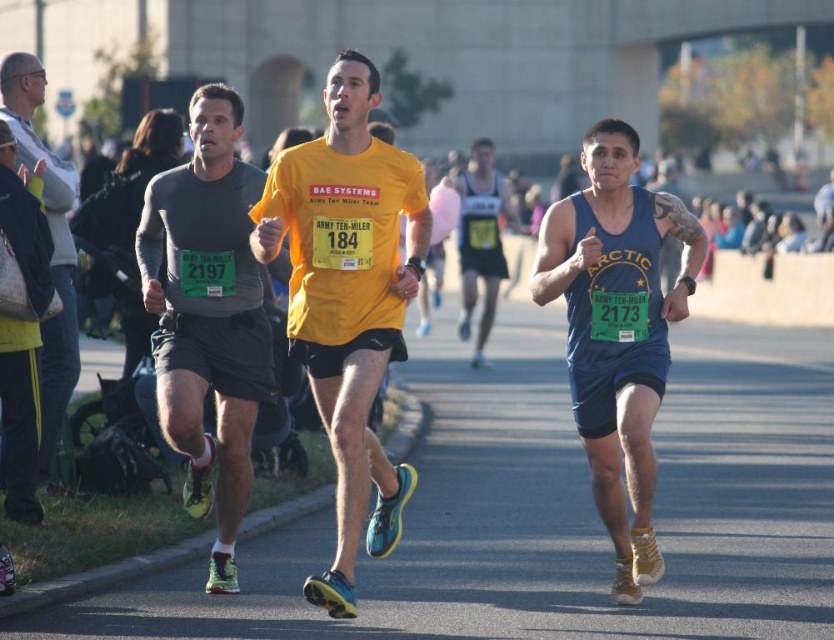
Can you confirm if matte blue tank top at center is smaller than matte gray long-sleeve shirt at left?

Yes, matte blue tank top at center is smaller than matte gray long-sleeve shirt at left.

Can you confirm if matte blue tank top at center is positioned to the right of matte gray long-sleeve shirt at left?

Yes, matte blue tank top at center is to the right of matte gray long-sleeve shirt at left.

Where is `matte blue tank top at center`? The image size is (834, 640). matte blue tank top at center is located at coordinates (616, 330).

Which of these two, yellow matte shirt at center or matte gray jacket at left, stands shorter?

With less height is matte gray jacket at left.

Is yellow matte shirt at center to the left of matte gray jacket at left from the viewer's perspective?

No, yellow matte shirt at center is not to the left of matte gray jacket at left.

I want to click on yellow matte shirt at center, so click(348, 300).

I want to click on yellow matte shirt at center, so click(x=348, y=300).

In the scene shown: Is matte gray long-sleeve shirt at left wider than matte gray jacket at left?

Correct, the width of matte gray long-sleeve shirt at left exceeds that of matte gray jacket at left.

Does matte gray long-sleeve shirt at left appear under matte gray jacket at left?

Yes.

Describe the element at coordinates (208, 314) in the screenshot. I see `matte gray long-sleeve shirt at left` at that location.

You are a GUI agent. You are given a task and a screenshot of the screen. Output one action in this format:
    pyautogui.click(x=<x>, y=<y>)
    Task: Click on the matte gray long-sleeve shirt at left
    This screenshot has width=834, height=640.
    Given the screenshot: What is the action you would take?
    pyautogui.click(x=208, y=314)